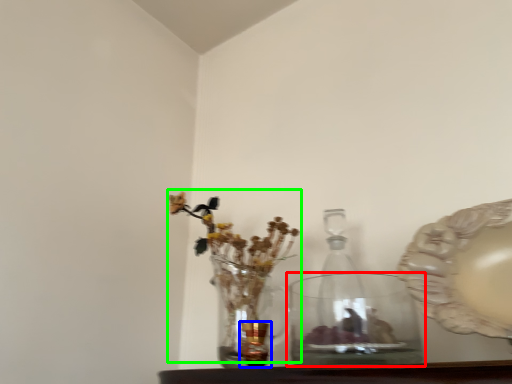
Question: Which object is positioned farthest from vase (highlighted by a red box)? Select from candle holder (highlighted by a blue box) and floral arrangement (highlighted by a green box).

Choices:
 (A) candle holder
 (B) floral arrangement

Answer: (A)